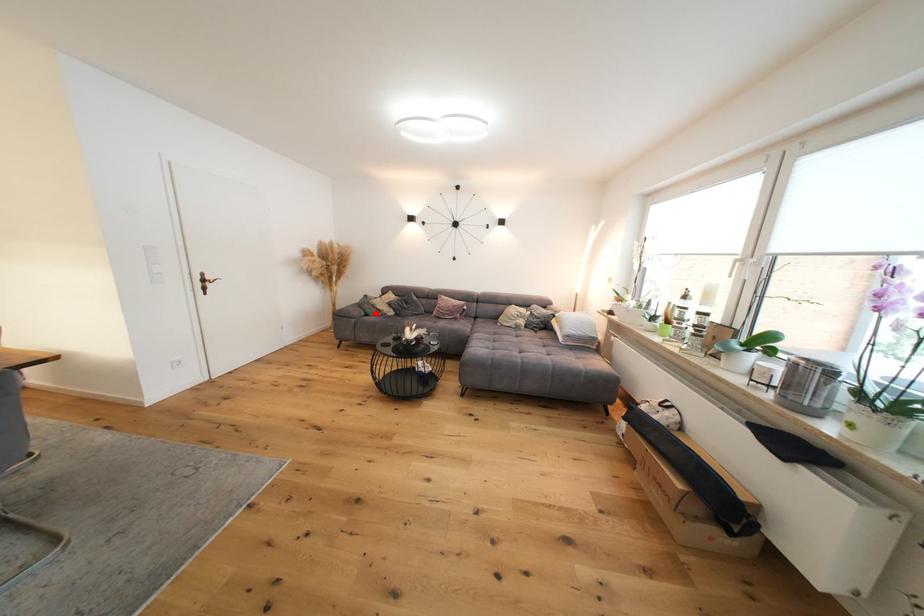
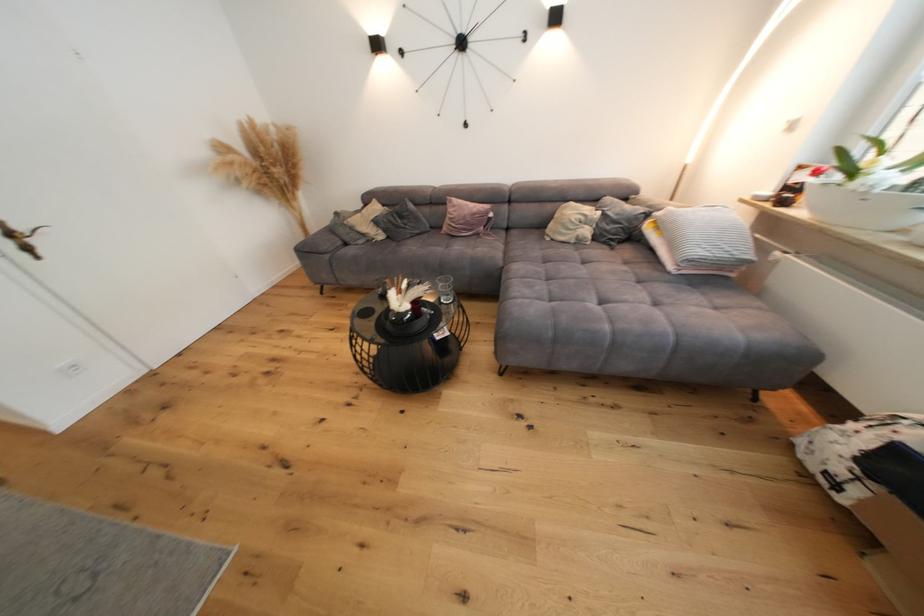
Find the pixel in the second image that matches the highlighted location in the first image.

(354, 240)